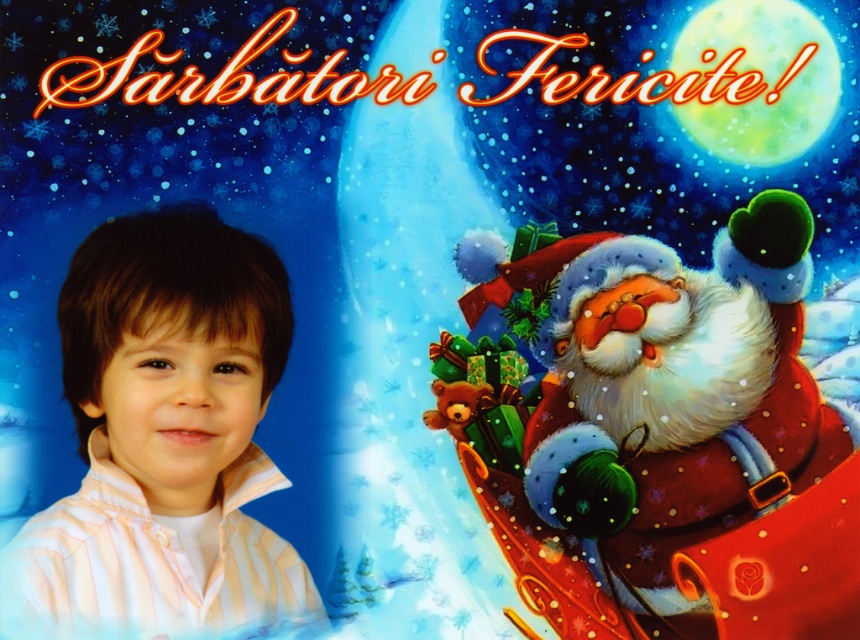
Consider the image. In the Christmas card scene, there is a fuzzy red Santa at right and a striped cotton shirt at left. From the perspective of an observer looking at the image, which object is positioned to the right of the other?

The fuzzy red santa at right is to the right of striped cotton shirt at left.

You are designing a layout for a Christmas card and need to place a fuzzy red santa at right and a striped cotton shirt at left. Given their sizes, which object should be placed closer to the front to maintain visual balance?

The fuzzy red santa at right is smaller in size compared to the striped cotton shirt at left. To maintain visual balance, the smaller fuzzy red santa at right should be placed closer to the front since smaller objects are typically positioned forward to balance with larger elements in the background.

You are a photographer setting up for a Christmas photo shoot. You need to position the fuzzy red santa at right and the striped cotton shirt at left so that they are exactly 30 inches apart. Based on the current setup shown in the image, should you move Santa closer to or farther away from the child?

The current distance between the fuzzy red santa at right and the striped cotton shirt at left is 25.32 inches. Since the desired distance is 30 inches, you need to move Santa farther away from the child to increase the distance by approximately 4.68 inches.